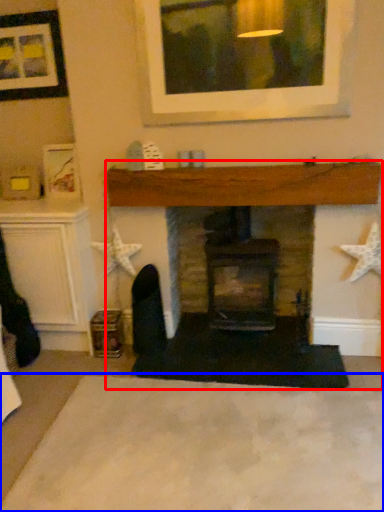
Question: Among these objects, which one is farthest to the camera, fireplace (highlighted by a red box) or plain (highlighted by a blue box)?

Choices:
 (A) fireplace
 (B) plain

Answer: (A)